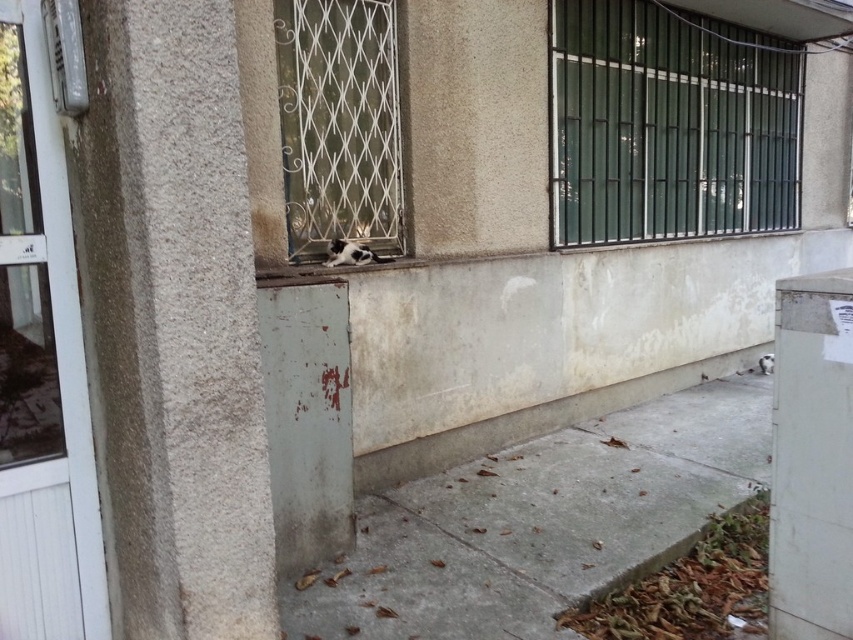
What are the coordinates of the green metal bars at upper right?

The green metal bars at upper right are located at coordinates point (669, 124).